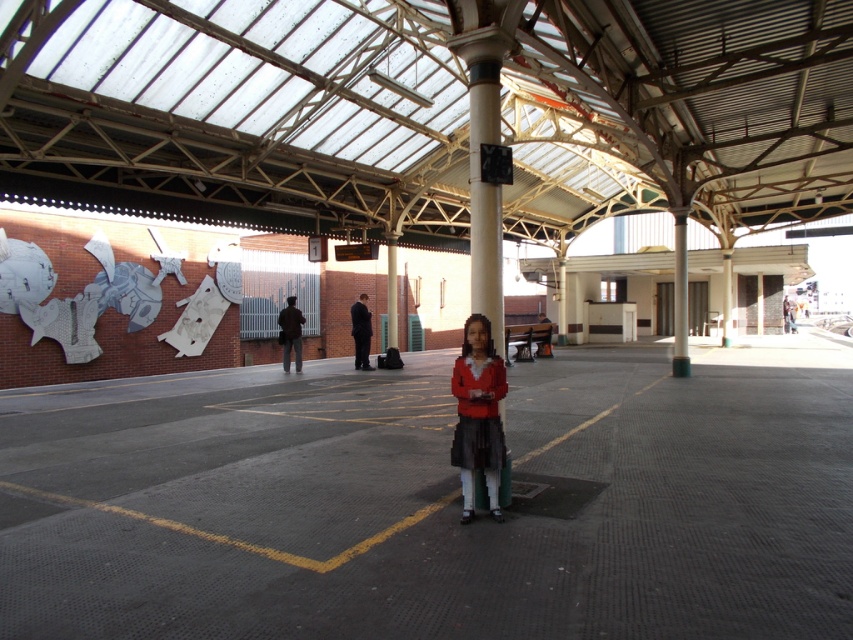
Question: Can you confirm if smooth asphalt parking lot at center is wider than metallic pole at center?

Choices:
 (A) no
 (B) yes

Answer: (B)

Question: Based on their relative distances, which object is farther from the smooth asphalt parking lot at center?

Choices:
 (A) metallic pole at center
 (B) matte red sweater at center

Answer: (A)

Question: Which object is farther from the camera taking this photo?

Choices:
 (A) smooth asphalt parking lot at center
 (B) matte red sweater at center
 (C) metallic pole at center

Answer: (C)

Question: Which of the following is the closest to the observer?

Choices:
 (A) (491, 449)
 (B) (683, 352)
 (C) (700, 390)

Answer: (A)

Question: Does matte red sweater at center have a smaller size compared to metallic pole at center?

Choices:
 (A) no
 (B) yes

Answer: (B)

Question: Does smooth asphalt parking lot at center appear on the left side of metallic pole at center?

Choices:
 (A) yes
 (B) no

Answer: (A)